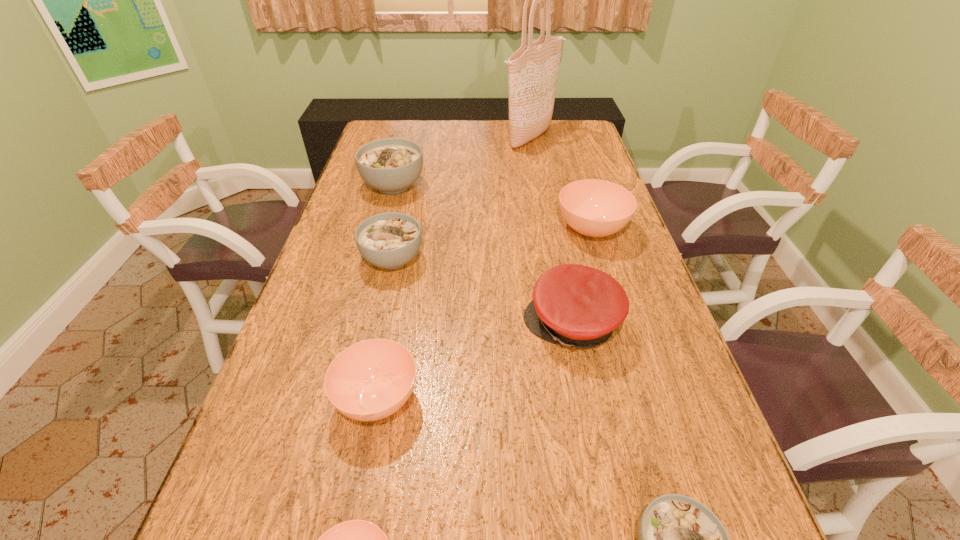
Locate an element on the screen. the second biggest peach soup bowl is located at coordinates (370, 380).

The image size is (960, 540). Find the location of `free region located on the left of the tallest object`. free region located on the left of the tallest object is located at coordinates (420, 138).

This screenshot has width=960, height=540. What are the coordinates of `free region located on the right of the second farthest object` in the screenshot? It's located at (540, 185).

The width and height of the screenshot is (960, 540). I want to click on vacant space located on the back of the farthest peach soup bowl, so click(572, 166).

Find the location of a particular element. The height and width of the screenshot is (540, 960). free space located 0.380m on the front of the cap with an emblem is located at coordinates (359, 324).

The width and height of the screenshot is (960, 540). I want to click on vacant area situated 0.330m on the front of the cap with an emblem, so click(x=381, y=324).

Identify the location of free space located on the front of the cap with an emblem. Image resolution: width=960 pixels, height=540 pixels. (429, 324).

Where is `free space located on the back of the second nearest white soup bowl`? Image resolution: width=960 pixels, height=540 pixels. free space located on the back of the second nearest white soup bowl is located at coordinates (407, 193).

In order to click on free location located 0.330m on the back of the fourth farthest soup bowl in this screenshot , I will do `click(404, 262)`.

Locate an element on the screen. object that is at the far edge is located at coordinates (533, 69).